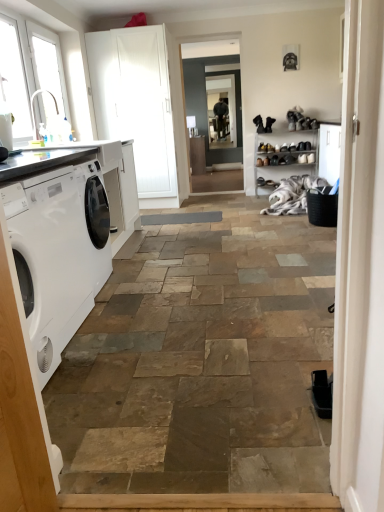
Where is `white plastic window at upper left, placed as the 1th window when sorted from front to back`? The width and height of the screenshot is (384, 512). white plastic window at upper left, placed as the 1th window when sorted from front to back is located at coordinates (14, 78).

Where is `white glass window at upper left, which appears as the first window when viewed from the back`? The width and height of the screenshot is (384, 512). white glass window at upper left, which appears as the first window when viewed from the back is located at coordinates (48, 64).

The width and height of the screenshot is (384, 512). What do you see at coordinates (136, 104) in the screenshot? I see `white matte screen door at upper left, arranged as the first screen door when viewed from the left` at bounding box center [136, 104].

Where is `black leather shoe at center`? The width and height of the screenshot is (384, 512). black leather shoe at center is located at coordinates (302, 158).

Find the location of a particular element. The width and height of the screenshot is (384, 512). clear glass screen door at center, the 2th screen door viewed from the left is located at coordinates (206, 102).

From the image's perspective, which is below, white plastic window at upper left, which is the second window from back to front, or white fluffy laundry at center?

white fluffy laundry at center.

Who is taller, white plastic window at upper left, placed as the 1th window when sorted from front to back, or white fluffy laundry at center?

With more height is white plastic window at upper left, placed as the 1th window when sorted from front to back.

Looking at their sizes, would you say white plastic window at upper left, which is the second window from back to front, is wider or thinner than white fluffy laundry at center?

Considering their sizes, white plastic window at upper left, which is the second window from back to front, looks slimmer than white fluffy laundry at center.

From a real-world perspective, starting from the white fluffy laundry at center, which window is the 2nd one vertically above it? Please provide its 2D coordinates.

[(14, 78)]

Which object is further away from the camera taking this photo, white fluffy laundry at center or clear glass window screen at center?

clear glass window screen at center is further from the camera.

Based on the photo, looking at their sizes, would you say white fluffy laundry at center is wider or thinner than clear glass window screen at center?

Clearly, white fluffy laundry at center has more width compared to clear glass window screen at center.

Between white fluffy laundry at center and clear glass window screen at center, which one appears on the right side from the viewer's perspective?

white fluffy laundry at center.

Can you tell me how much black leather shoe at center and white glass window at upper left, which is counted as the 2th window, starting from the front, differ in facing direction?

The angle between the facing direction of black leather shoe at center and the facing direction of white glass window at upper left, which is counted as the 2th window, starting from the front, is 91.2 degrees.

Considering the relative positions of black leather shoe at center and white glass window at upper left, which is counted as the 2th window, starting from the front, in the image provided, is black leather shoe at center in front of white glass window at upper left, which is counted as the 2th window, starting from the front,?

No.

The width and height of the screenshot is (384, 512). I want to click on shoe below the white glass window at upper left, which is counted as the 2th window, starting from the front (from the image's perspective), so click(302, 158).

Is white glass window at upper left, which appears as the first window when viewed from the back, at the back of black leather shoe at center?

No, white glass window at upper left, which appears as the first window when viewed from the back, is not at the back of black leather shoe at center.

Is white plastic window at upper left, placed as the 1th window when sorted from front to back, in front of or behind clear glass screen door at center, the 1th screen door viewed from the right, in the image?

Visually, white plastic window at upper left, placed as the 1th window when sorted from front to back, is located in front of clear glass screen door at center, the 1th screen door viewed from the right.

From a real-world perspective, between white plastic window at upper left, which is the second window from back to front, and clear glass screen door at center, the 2th screen door viewed from the left, who is vertically lower?

clear glass screen door at center, the 2th screen door viewed from the left, is physically lower.

Measure the distance between white plastic window at upper left, which is the second window from back to front, and clear glass screen door at center, the 2th screen door viewed from the left.

white plastic window at upper left, which is the second window from back to front, and clear glass screen door at center, the 2th screen door viewed from the left, are 14.83 feet apart from each other.

From the image's perspective, between white plastic window at upper left, which is the second window from back to front, and clear glass screen door at center, the 1th screen door viewed from the right, who is located below?

From the image's view, white plastic window at upper left, which is the second window from back to front, is below.

Is black leather shoe at center located outside clear glass screen door at center, the 2th screen door viewed from the left?

black leather shoe at center lies outside clear glass screen door at center, the 2th screen door viewed from the left,'s area.

Considering the sizes of objects black leather shoe at center and clear glass screen door at center, the 1th screen door viewed from the right, in the image provided, who is taller, black leather shoe at center or clear glass screen door at center, the 1th screen door viewed from the right,?

clear glass screen door at center, the 1th screen door viewed from the right, is taller.

Considering the sizes of objects black leather shoe at center and clear glass screen door at center, the 1th screen door viewed from the right, in the image provided, who is thinner, black leather shoe at center or clear glass screen door at center, the 1th screen door viewed from the right,?

clear glass screen door at center, the 1th screen door viewed from the right.

From a real-world perspective, is black leather shoe at center physically located above or below clear glass screen door at center, the 1th screen door viewed from the right?

In terms of real-world spatial position, black leather shoe at center is below clear glass screen door at center, the 1th screen door viewed from the right.

You are a GUI agent. You are given a task and a screenshot of the screen. Output one action in this format:
    pyautogui.click(x=<x>, y=<y>)
    Task: Click on the 2nd screen door behind the white fluffy laundry at center
    
    Given the screenshot: What is the action you would take?
    pyautogui.click(x=206, y=102)

Is white fluffy laundry at center next to clear glass screen door at center, the 2th screen door viewed from the left, and touching it?

No, white fluffy laundry at center is not making contact with clear glass screen door at center, the 2th screen door viewed from the left.

Is white fluffy laundry at center at the left side of clear glass screen door at center, the 1th screen door viewed from the right?

Incorrect, white fluffy laundry at center is not on the left side of clear glass screen door at center, the 1th screen door viewed from the right.

Consider the image. Is clear glass screen door at center, the 1th screen door viewed from the right, not within white fluffy laundry at center?

Yes.

From a real-world perspective, is clear glass screen door at center, the 1th screen door viewed from the right, on top of white fluffy laundry at center?

Yes, from a real-world perspective, clear glass screen door at center, the 1th screen door viewed from the right, is on top of white fluffy laundry at center.

Based on the photo, considering the relative positions of clear glass screen door at center, the 2th screen door viewed from the left, and white fluffy laundry at center in the image provided, is clear glass screen door at center, the 2th screen door viewed from the left, to the left of white fluffy laundry at center from the viewer's perspective?

Yes.

From the image's perspective, does clear glass screen door at center, the 1th screen door viewed from the right, appear lower than white fluffy laundry at center?

No.

Which window is the 2nd one when counting from the front of the white fluffy laundry at center? Please provide its 2D coordinates.

[(14, 78)]

At what (x,y) coordinates should I click in order to perform the action: click on window screen on the left of the white fluffy laundry at center. Please return your answer as a coordinate pair (x, y). Looking at the image, I should click on (221, 111).

Which object lies nearer to the anchor point white matte screen door at upper left, the 2th screen door from the right, clear glass window screen at center or white plastic window at upper left, which is the second window from back to front?

Based on the image, white plastic window at upper left, which is the second window from back to front, appears to be nearer to white matte screen door at upper left, the 2th screen door from the right.

Which object lies further to the anchor point clear glass window screen at center, black leather shoe at center or white glass window at upper left, which is counted as the 2th window, starting from the front?

white glass window at upper left, which is counted as the 2th window, starting from the front, is positioned further to the anchor clear glass window screen at center.

Based on their spatial positions, is white matte screen door at upper left, the 2th screen door from the right, or clear glass screen door at center, the 2th screen door viewed from the left, closer to clear glass window screen at center?

Based on the image, clear glass screen door at center, the 2th screen door viewed from the left, appears to be nearer to clear glass window screen at center.

Looking at the image, which one is located further to black leather shoe at center, clear glass window screen at center or white matte screen door at upper left, the 2th screen door from the right?

white matte screen door at upper left, the 2th screen door from the right, is positioned further to the anchor black leather shoe at center.

When comparing their distances from clear glass screen door at center, the 2th screen door viewed from the left, does white matte screen door at upper left, the 2th screen door from the right, or white glass window at upper left, which appears as the first window when viewed from the back, seem further?

white glass window at upper left, which appears as the first window when viewed from the back.

When comparing their distances from clear glass window screen at center, does white glass window at upper left, which appears as the first window when viewed from the back, or black leather shoe at center seem closer?

black leather shoe at center lies closer to clear glass window screen at center than the other object.

From the image, which object appears to be nearer to white plastic window at upper left, which is the second window from back to front, white matte screen door at upper left, the 2th screen door from the right, or white glass window at upper left, which appears as the first window when viewed from the back?

Based on the image, white glass window at upper left, which appears as the first window when viewed from the back, appears to be nearer to white plastic window at upper left, which is the second window from back to front.

From the image, which object appears to be nearer to black leather shoe at center, white matte screen door at upper left, arranged as the first screen door when viewed from the left, or clear glass screen door at center, the 2th screen door viewed from the left?

The object closer to black leather shoe at center is clear glass screen door at center, the 2th screen door viewed from the left.

In order to click on window located between white plastic window at upper left, which is the second window from back to front, and clear glass window screen at center in the depth direction in this screenshot , I will do `click(48, 64)`.

The height and width of the screenshot is (512, 384). What are the coordinates of `shoe between white glass window at upper left, which appears as the first window when viewed from the back, and clear glass window screen at center from front to back` in the screenshot? It's located at (302, 158).

Identify the location of screen door situated between white matte screen door at upper left, arranged as the first screen door when viewed from the left, and white fluffy laundry at center from left to right. Image resolution: width=384 pixels, height=512 pixels. (206, 102).

Locate an element on the screen. This screenshot has width=384, height=512. screen door situated between white glass window at upper left, which appears as the first window when viewed from the back, and clear glass screen door at center, the 2th screen door viewed from the left, from left to right is located at coordinates (136, 104).